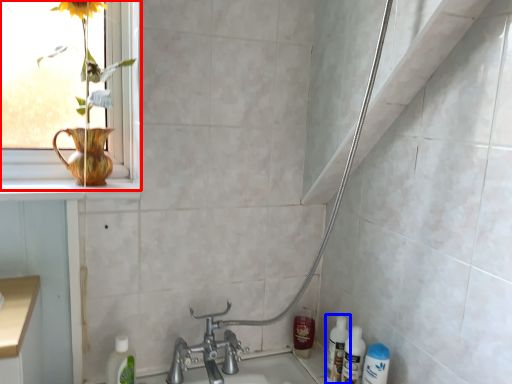
Question: Which point is closer to the camera, window (highlighted by a red box) or bottle (highlighted by a blue box)?

Choices:
 (A) window
 (B) bottle

Answer: (A)